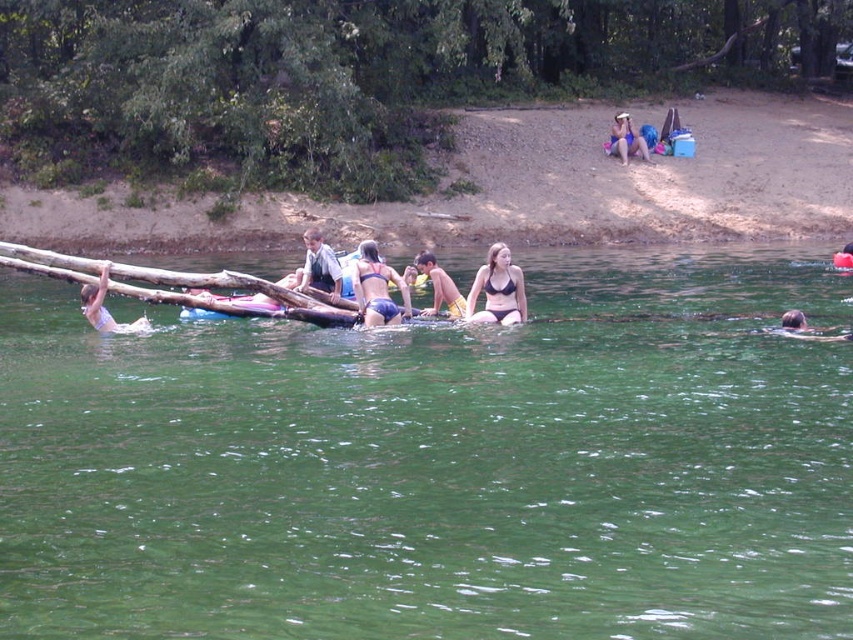
Question: Does green water at center appear under dark blue shirt at center?

Choices:
 (A) yes
 (B) no

Answer: (A)

Question: Which object is positioned farthest from the black matte bikini at center?

Choices:
 (A) matte white swimsuit at left
 (B) dark blue shirt at center

Answer: (B)

Question: From the image, what is the correct spatial relationship of black matte bikini at center in relation to matte blue bikini at center?

Choices:
 (A) left
 (B) right

Answer: (B)

Question: Which point is farther from the camera taking this photo?

Choices:
 (A) (381, 292)
 (B) (421, 260)
 (C) (312, 244)
 (D) (622, 124)

Answer: (D)

Question: Which of the following is the closest to the observer?

Choices:
 (A) matte blue bikini at center
 (B) smooth brown hair at lower right
 (C) black matte bikini at center
 (D) green water at center

Answer: (D)

Question: In this image, where is matte blue bikini at center located relative to black bikini at center?

Choices:
 (A) above
 (B) below

Answer: (B)